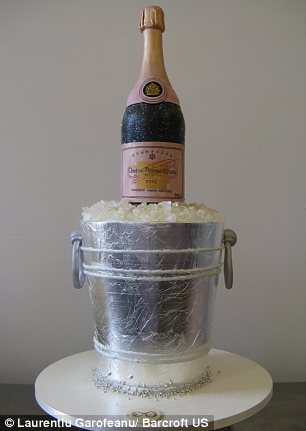
You are a GUI agent. You are given a task and a screenshot of the screen. Output one action in this format:
    pyautogui.click(x=<x>, y=<y>)
    Task: Click on the handle
    This screenshot has width=306, height=431.
    Given the screenshot: What is the action you would take?
    pyautogui.click(x=231, y=281)